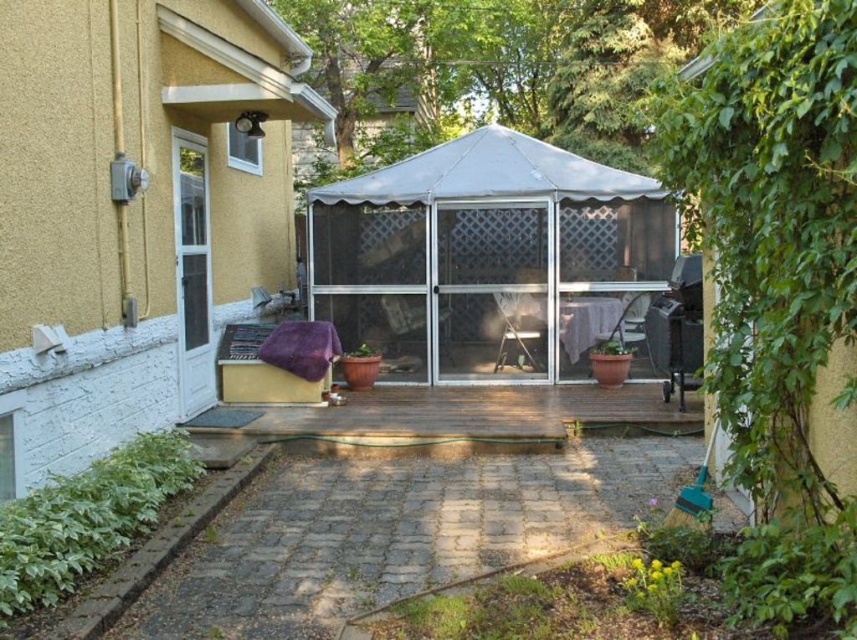
Can you confirm if purple fabric at lower center is positioned to the right of white painted wood glass door at left?

Yes, purple fabric at lower center is to the right of white painted wood glass door at left.

What do you see at coordinates (135, 211) in the screenshot? I see `purple fabric at lower center` at bounding box center [135, 211].

Between point (57, 234) and point (201, 205), which one is positioned in front?

Point (57, 234)

You are a GUI agent. You are given a task and a screenshot of the screen. Output one action in this format:
    pyautogui.click(x=<x>, y=<y>)
    Task: Click on the purple fabric at lower center
    
    Given the screenshot: What is the action you would take?
    pyautogui.click(x=135, y=211)

Can you confirm if purple fabric at lower center is positioned to the right of white fabric canopy at center?

In fact, purple fabric at lower center is to the left of white fabric canopy at center.

The height and width of the screenshot is (640, 857). Describe the element at coordinates (135, 211) in the screenshot. I see `purple fabric at lower center` at that location.

Locate an element on the screen. The width and height of the screenshot is (857, 640). purple fabric at lower center is located at coordinates (135, 211).

Does clear plastic screen door at center have a smaller size compared to white fabric canopy at center?

Yes.

Does clear plastic screen door at center appear on the left side of white fabric canopy at center?

No, clear plastic screen door at center is not to the left of white fabric canopy at center.

Which is in front, point (541, 244) or point (490, 128)?

Point (541, 244) is more forward.

Identify the location of clear plastic screen door at center. (490, 289).